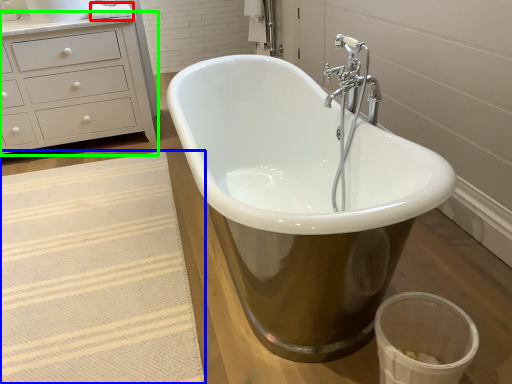
Question: Which object is the closest to the toilet paper (highlighted by a red box)? Choose among these: bath mat (highlighted by a blue box) or chest of drawers (highlighted by a green box).

Choices:
 (A) bath mat
 (B) chest of drawers

Answer: (B)